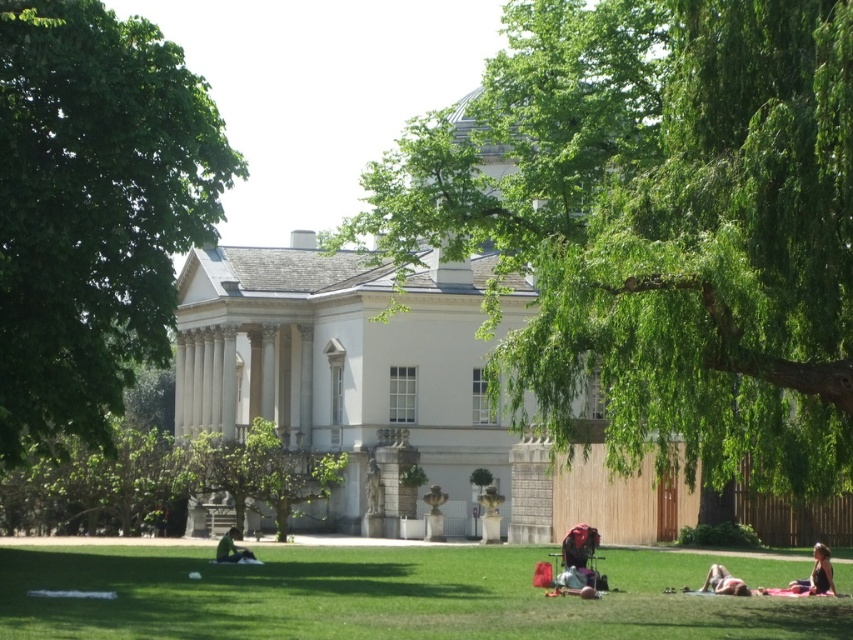
Which is above, green leafy tree at center or green leafy tree at left?

Positioned higher is green leafy tree at center.

Where is `green leafy tree at center`? green leafy tree at center is located at coordinates (659, 225).

Is green leafy tree at center positioned at the back of green grass at lower center?

No, green leafy tree at center is in front of green grass at lower center.

Between green leafy tree at center and green grass at lower center, which one is positioned higher?

green leafy tree at center is above.

At what (x,y) coordinates should I click in order to perform the action: click on green leafy tree at center. Please return your answer as a coordinate pair (x, y). The height and width of the screenshot is (640, 853). Looking at the image, I should click on (659, 225).

I want to click on green leafy tree at center, so click(x=659, y=225).

Which of these two, green leafy tree at left or skinny jeans at lower right, stands shorter?

skinny jeans at lower right

Between point (54, 259) and point (738, 592), which one is positioned behind?

The point (54, 259) is more distant.

Is point (134, 205) more distant than point (723, 582)?

Yes, it is.

I want to click on green leafy tree at left, so [93, 209].